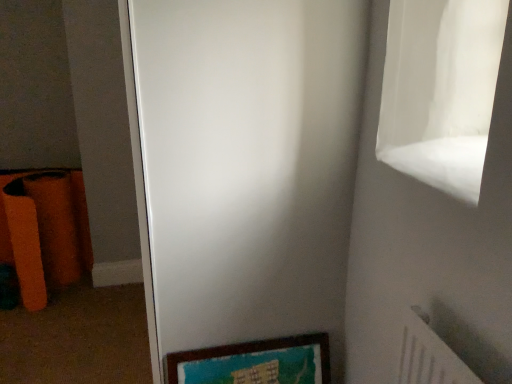
Question: Can you confirm if white matte screen door at center is wider than wooden picture frame at lower center?

Choices:
 (A) no
 (B) yes

Answer: (B)

Question: Does white matte screen door at center have a larger size compared to wooden picture frame at lower center?

Choices:
 (A) no
 (B) yes

Answer: (B)

Question: From the image's perspective, is white matte screen door at center over wooden picture frame at lower center?

Choices:
 (A) no
 (B) yes

Answer: (B)

Question: Considering the relative sizes of white matte screen door at center and wooden picture frame at lower center in the image provided, is white matte screen door at center smaller than wooden picture frame at lower center?

Choices:
 (A) yes
 (B) no

Answer: (B)

Question: Does white matte screen door at center have a greater height compared to wooden picture frame at lower center?

Choices:
 (A) no
 (B) yes

Answer: (B)

Question: Does white matte screen door at center appear on the right side of wooden picture frame at lower center?

Choices:
 (A) no
 (B) yes

Answer: (A)

Question: Considering the relative sizes of wooden picture frame at lower center and white matte screen door at center in the image provided, is wooden picture frame at lower center smaller than white matte screen door at center?

Choices:
 (A) no
 (B) yes

Answer: (B)

Question: Is wooden picture frame at lower center wider than white matte screen door at center?

Choices:
 (A) no
 (B) yes

Answer: (A)

Question: Is wooden picture frame at lower center positioned with its back to white matte screen door at center?

Choices:
 (A) no
 (B) yes

Answer: (B)

Question: Is wooden picture frame at lower center outside of white matte screen door at center?

Choices:
 (A) no
 (B) yes

Answer: (A)

Question: Is wooden picture frame at lower center in front of white matte screen door at center?

Choices:
 (A) yes
 (B) no

Answer: (B)

Question: From the image's perspective, does wooden picture frame at lower center appear lower than white matte screen door at center?

Choices:
 (A) yes
 (B) no

Answer: (A)

Question: From the image's perspective, is white matte screen door at center above or below wooden picture frame at lower center?

Choices:
 (A) below
 (B) above

Answer: (B)